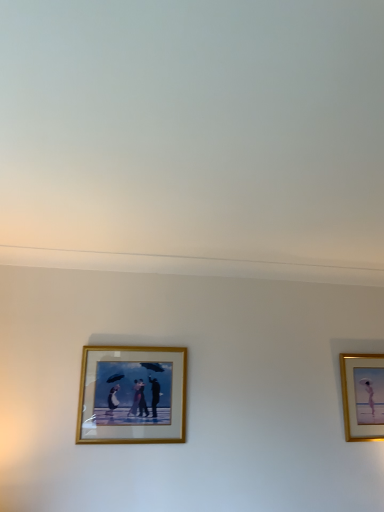
Question: Should I look upward or downward to see gold/glass picture frame at center, acting as the 1th picture frame starting from the left?

Choices:
 (A) down
 (B) up

Answer: (A)

Question: Is gold/glass picture frame at center, the second picture frame in the right-to-left sequence, taller than gold-framed picture at right, which ranks as the first picture frame in right-to-left order?

Choices:
 (A) yes
 (B) no

Answer: (B)

Question: Is gold/glass picture frame at center, acting as the 1th picture frame starting from the left, not close to gold-framed picture at right, the 1th picture frame in the back-to-front sequence?

Choices:
 (A) no
 (B) yes

Answer: (B)

Question: Is gold/glass picture frame at center, acting as the 1th picture frame starting from the left, outside of gold-framed picture at right, which ranks as the first picture frame in right-to-left order?

Choices:
 (A) yes
 (B) no

Answer: (A)

Question: Is gold-framed picture at right, acting as the 2th picture frame starting from the front, located within gold/glass picture frame at center, which appears as the first picture frame when viewed from the front?

Choices:
 (A) no
 (B) yes

Answer: (A)

Question: From a real-world perspective, is gold/glass picture frame at center, which is the second picture frame in back-to-front order, physically above gold-framed picture at right, the second picture frame in the left-to-right sequence?

Choices:
 (A) yes
 (B) no

Answer: (B)

Question: Is gold/glass picture frame at center, which is the second picture frame in back-to-front order, at the right side of gold-framed picture at right, acting as the 2th picture frame starting from the front?

Choices:
 (A) no
 (B) yes

Answer: (A)

Question: From a real-world perspective, is gold-framed picture at right, the 1th picture frame in the back-to-front sequence, physically above gold/glass picture frame at center, acting as the 1th picture frame starting from the left?

Choices:
 (A) yes
 (B) no

Answer: (A)

Question: Is gold-framed picture at right, which ranks as the first picture frame in right-to-left order, positioned far away from gold/glass picture frame at center, acting as the 1th picture frame starting from the left?

Choices:
 (A) no
 (B) yes

Answer: (B)

Question: From a real-world perspective, is gold-framed picture at right, the second picture frame in the left-to-right sequence, physically below gold/glass picture frame at center, acting as the 1th picture frame starting from the left?

Choices:
 (A) no
 (B) yes

Answer: (A)

Question: Is gold-framed picture at right, the 1th picture frame in the back-to-front sequence, surrounding gold/glass picture frame at center, which is the second picture frame in back-to-front order?

Choices:
 (A) yes
 (B) no

Answer: (B)

Question: Is gold-framed picture at right, acting as the 2th picture frame starting from the front, to the left of gold/glass picture frame at center, which appears as the first picture frame when viewed from the front, from the viewer's perspective?

Choices:
 (A) yes
 (B) no

Answer: (B)

Question: Does gold-framed picture at right, the second picture frame in the left-to-right sequence, come in front of gold/glass picture frame at center, the second picture frame in the right-to-left sequence?

Choices:
 (A) yes
 (B) no

Answer: (B)

Question: Does point (172, 368) appear closer or farther from the camera than point (362, 428)?

Choices:
 (A) farther
 (B) closer

Answer: (B)